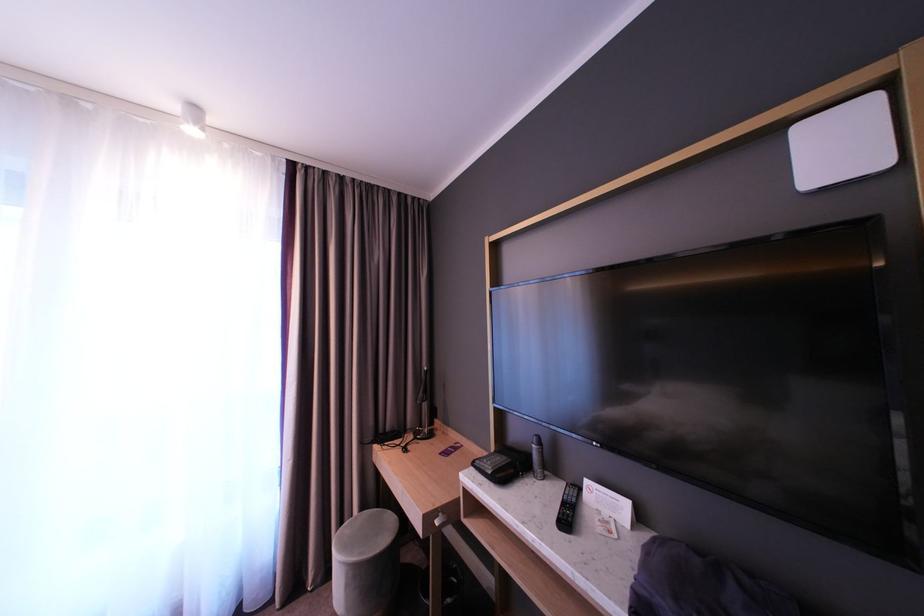
This screenshot has width=924, height=616. What do you see at coordinates (363, 535) in the screenshot? I see `a grey stool sitting surface` at bounding box center [363, 535].